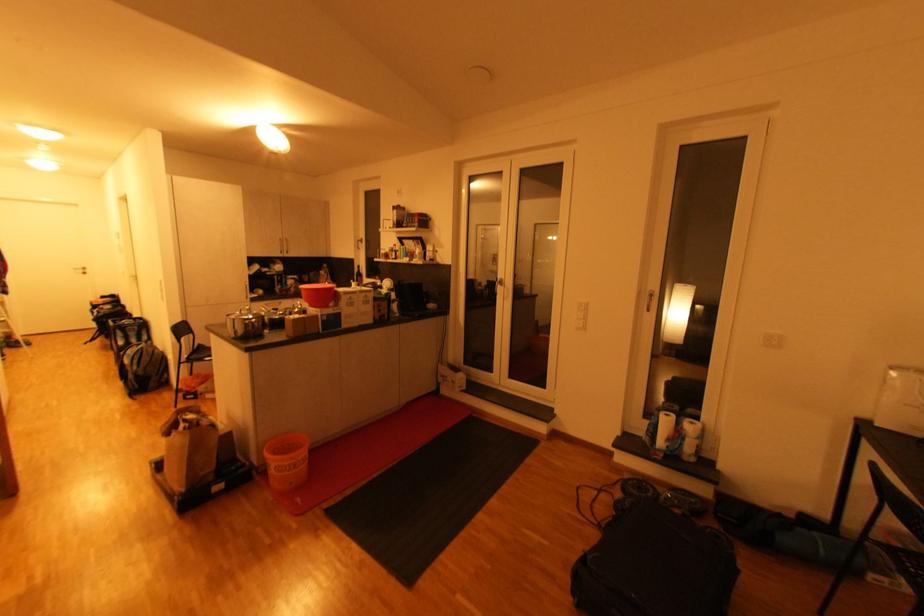
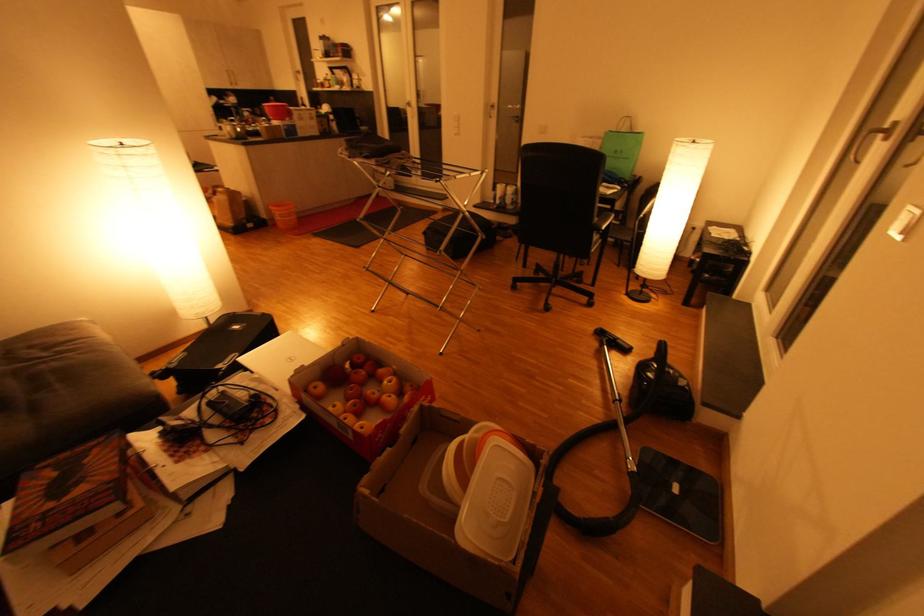
The point at (x=276, y=471) is marked in the first image. Where is the corresponding point in the second image?

(282, 219)